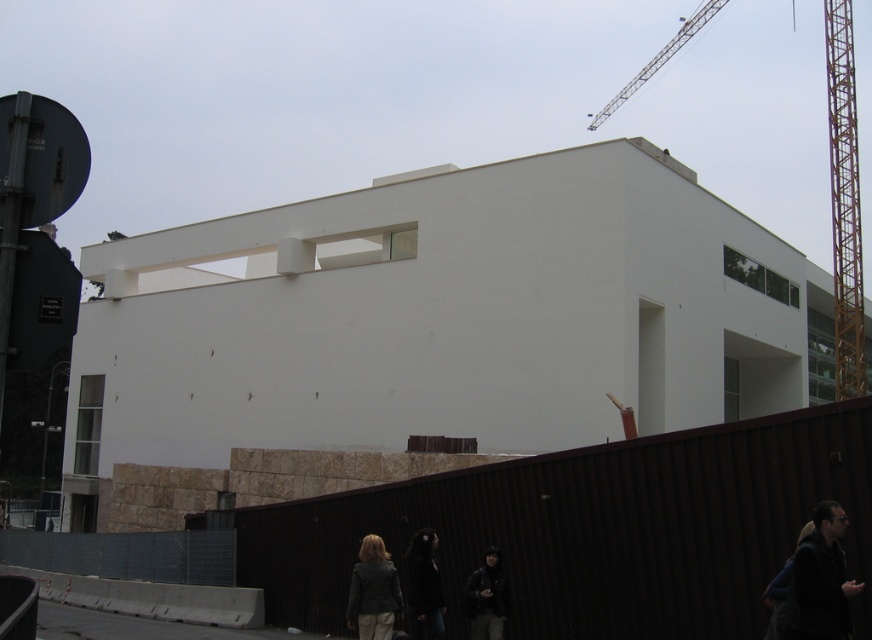
You are standing at point (440, 321) in the image. What structure is directly in front of you?

The white smooth building at center is directly in front of you at point (440, 321).

You are standing in front of the building and want to locate the dark matte coat at lower center. According to the coordinates provided, where exactly would you find it?

The dark matte coat at lower center is located at point (424, 588).